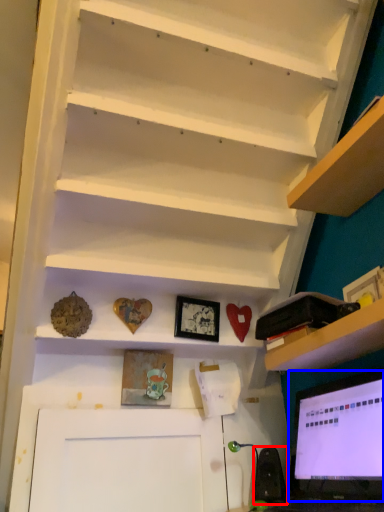
Question: Which object appears closest to the camera in this image, speaker (highlighted by a red box) or computer monitor (highlighted by a blue box)?

Choices:
 (A) speaker
 (B) computer monitor

Answer: (B)